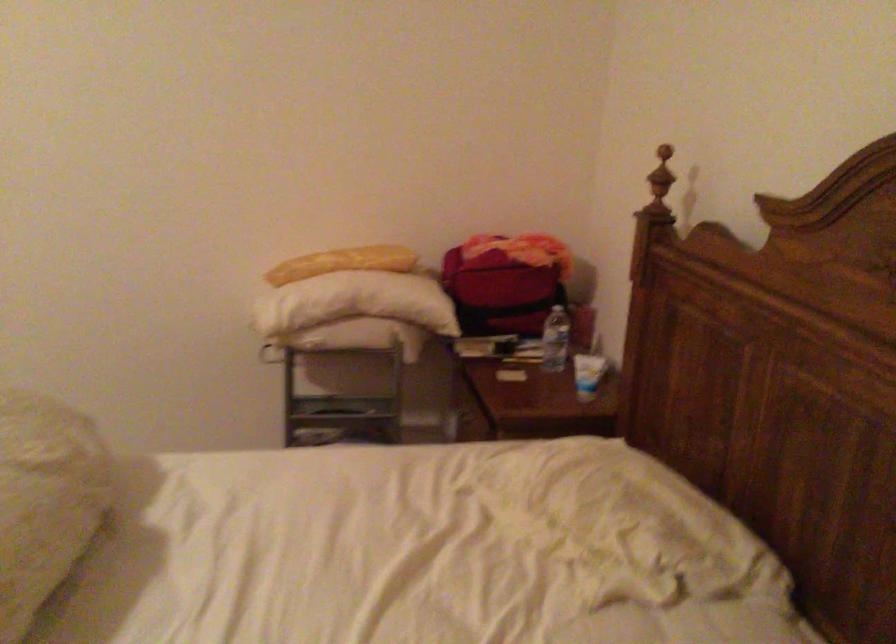
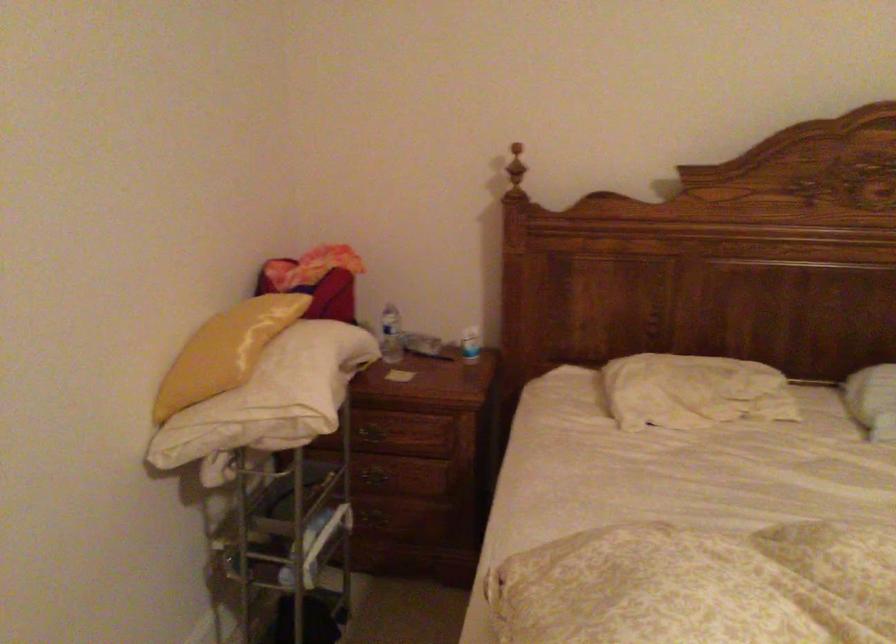
The point at (581, 373) is marked in the first image. Where is the corresponding point in the second image?

(470, 344)